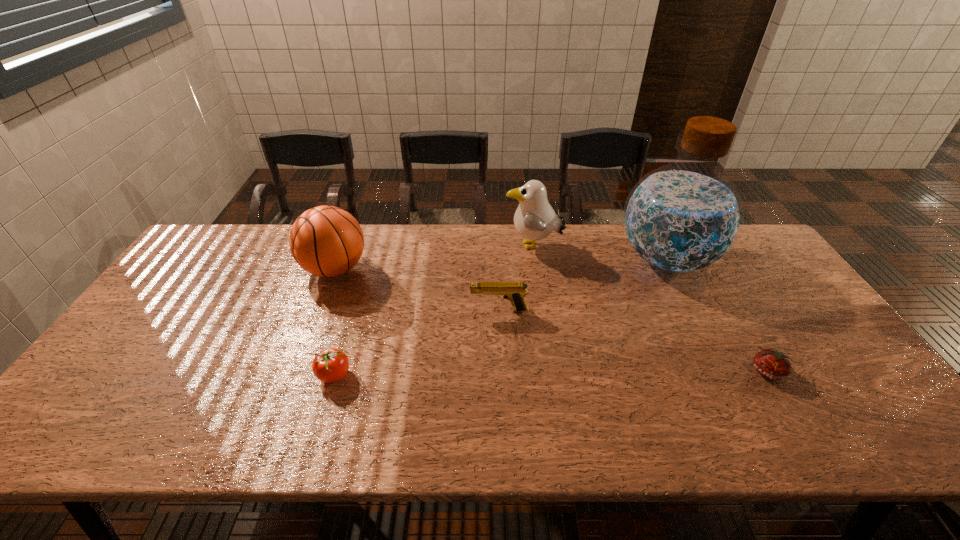
Find the location of a particular element. This screenshot has width=960, height=540. vacant space in between the right tomato and the basketball is located at coordinates (552, 320).

Identify the location of vacant area between the gull and the right tomato. This screenshot has width=960, height=540. [651, 309].

Locate an element on the screen. This screenshot has height=540, width=960. empty location between the tallest object and the right tomato is located at coordinates (717, 315).

Identify the location of free space between the tallest object and the shortest object. (717, 315).

Find the location of a particular element. free space that is in between the pistol and the gull is located at coordinates [516, 279].

Find the location of a particular element. This screenshot has height=540, width=960. empty space between the tallest object and the shortest object is located at coordinates (717, 315).

Locate an element on the screen. free space between the basketball and the gull is located at coordinates (434, 258).

Find the location of a particular element. Image resolution: width=960 pixels, height=540 pixels. empty space between the pistol and the left tomato is located at coordinates (417, 343).

Identify which object is the fifth closest to the fourth tallest object. Please provide its 2D coordinates. Your answer should be formatted as a tuple, i.e. [(x, y)], where the tuple contains the x and y coordinates of a point satisfying the conditions above.

[(774, 365)]

This screenshot has width=960, height=540. I want to click on object identified as the fifth closest to the fourth tallest object, so click(774, 365).